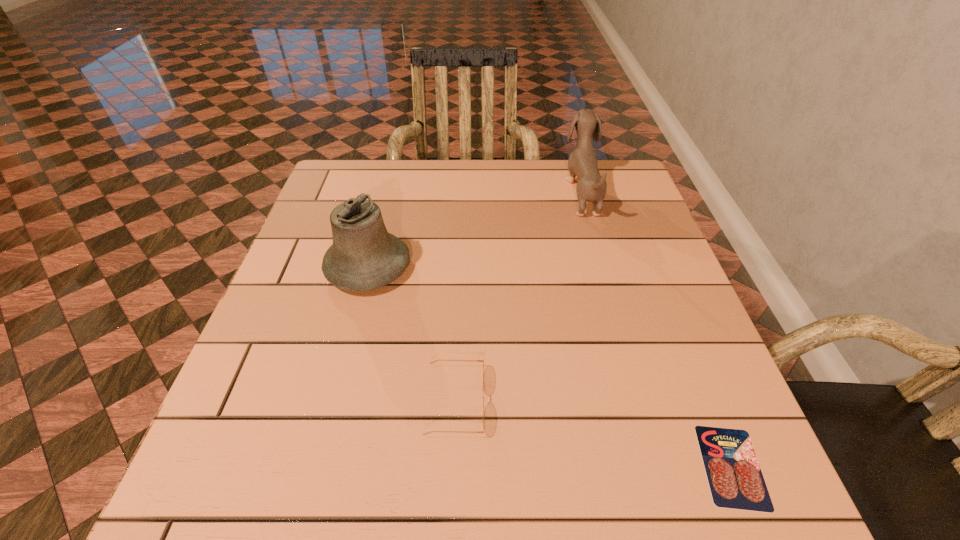
Locate an element on the screen. free space that satisfies the following two spatial constraints: 1. on the face of the third object from right to left; 2. on the left side of the rightmost object is located at coordinates (452, 467).

Image resolution: width=960 pixels, height=540 pixels. What are the coordinates of `vacant area in the image that satisfies the following two spatial constraints: 1. on the face of the third object from right to left; 2. on the left side of the rightmost object` in the screenshot? It's located at (452, 467).

The height and width of the screenshot is (540, 960). I want to click on vacant area in the image that satisfies the following two spatial constraints: 1. on the front side of the bell; 2. on the left side of the salami, so click(x=316, y=467).

You are a GUI agent. You are given a task and a screenshot of the screen. Output one action in this format:
    pyautogui.click(x=<x>, y=<y>)
    Task: Click on the free spot that satisfies the following two spatial constraints: 1. on the face of the second shortest object; 2. on the right side of the shortest object
    The height and width of the screenshot is (540, 960).
    Given the screenshot: What is the action you would take?
    pyautogui.click(x=452, y=467)

At what (x,y) coordinates should I click in order to perform the action: click on vacant space that satisfies the following two spatial constraints: 1. at the face of the farthest object; 2. on the right side of the shortest object. Please return your answer as a coordinate pair (x, y). The width and height of the screenshot is (960, 540). Looking at the image, I should click on (660, 467).

What are the coordinates of `vacant space that satisfies the following two spatial constraints: 1. on the face of the sunglasses; 2. on the left side of the rightmost object` in the screenshot? It's located at (452, 467).